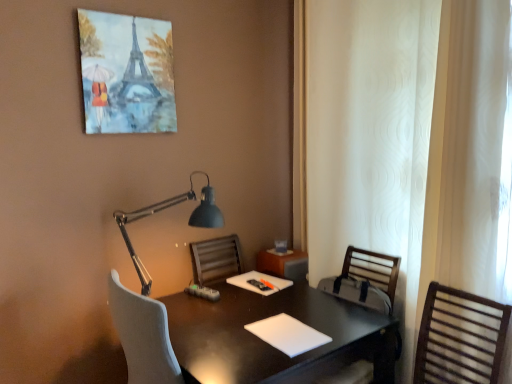
Find the location of a particular element. free space in front of white matte notepad at center, which is the first notepad from bottom to top is located at coordinates (267, 361).